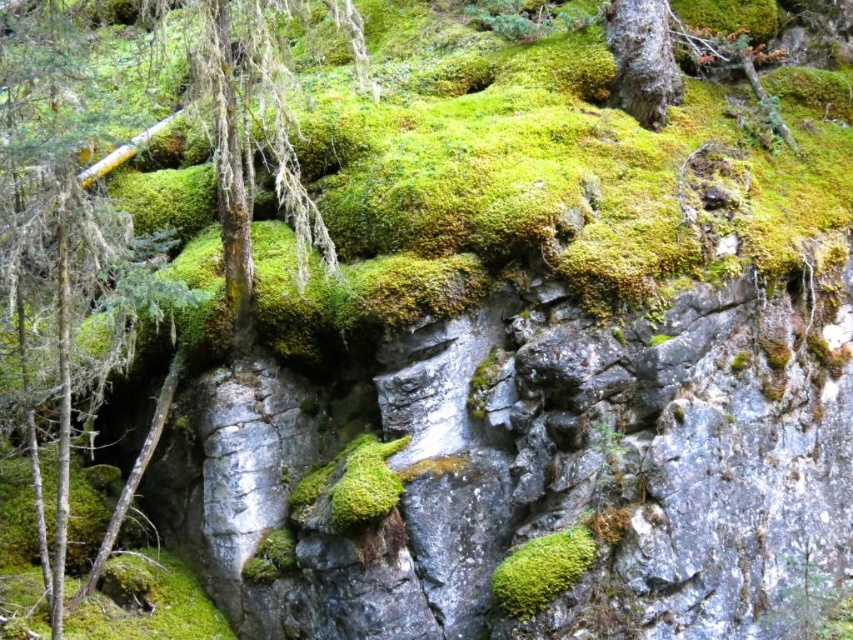
Question: Is green mossy tree at upper left thinner than green mossy bark at upper right?

Choices:
 (A) yes
 (B) no

Answer: (B)

Question: Is green mossy tree at upper left thinner than green mossy bark at upper right?

Choices:
 (A) no
 (B) yes

Answer: (A)

Question: Can you confirm if green mossy tree at upper left is positioned to the right of green mossy bark at upper right?

Choices:
 (A) yes
 (B) no

Answer: (B)